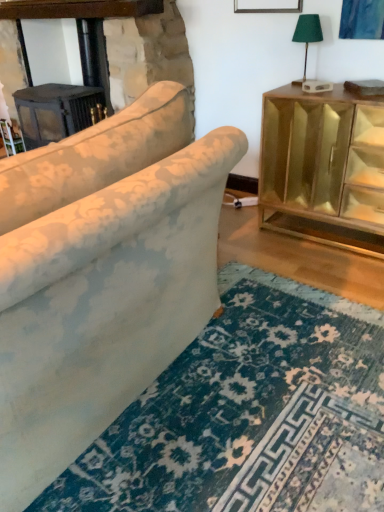
Describe the element at coordinates (323, 167) in the screenshot. This screenshot has height=512, width=384. I see `gold mirrored cabinet at right` at that location.

Where is `gold mirrored cabinet at right`? The image size is (384, 512). gold mirrored cabinet at right is located at coordinates (323, 167).

This screenshot has width=384, height=512. Identify the location of green fabric lampshade at upper right. (307, 36).

The height and width of the screenshot is (512, 384). Identify the location of dark gray wood fireplace at upper left. (83, 28).

Identify the location of gold mirrored cabinet at right. tap(323, 167).

Considering their positions, is gold mirrored cabinet at right located in front of or behind dark gray wood fireplace at upper left?

Visually, gold mirrored cabinet at right is located in front of dark gray wood fireplace at upper left.

Considering the positions of point (353, 247) and point (84, 9), is point (353, 247) closer or farther from the camera than point (84, 9)?

Point (353, 247) is closer to the camera than point (84, 9).

I want to click on fireplace to the left of gold mirrored cabinet at right, so click(x=83, y=28).

From the image's perspective, who appears lower, gold mirrored cabinet at right or dark gray wood fireplace at upper left?

From the image's view, gold mirrored cabinet at right is below.

Considering the sizes of objects dark gray wood fireplace at upper left and green fabric lampshade at upper right in the image provided, who is shorter, dark gray wood fireplace at upper left or green fabric lampshade at upper right?

green fabric lampshade at upper right is shorter.

From a real-world perspective, between dark gray wood fireplace at upper left and green fabric lampshade at upper right, who is vertically lower?

From a 3D spatial view, dark gray wood fireplace at upper left is below.

Could you tell me if dark gray wood fireplace at upper left is turned towards green fabric lampshade at upper right?

No.

Does dark gray wood fireplace at upper left have a smaller size compared to green fabric lampshade at upper right?

No, dark gray wood fireplace at upper left is not smaller than green fabric lampshade at upper right.

Which object is closer to the camera taking this photo, dark gray wood fireplace at upper left or gold mirrored cabinet at right?

gold mirrored cabinet at right is more forward.

Which is more to the left, dark gray wood fireplace at upper left or gold mirrored cabinet at right?

Positioned to the left is dark gray wood fireplace at upper left.

Consider the image. Considering the relative sizes of dark gray wood fireplace at upper left and gold mirrored cabinet at right in the image provided, is dark gray wood fireplace at upper left shorter than gold mirrored cabinet at right?

No, dark gray wood fireplace at upper left is not shorter than gold mirrored cabinet at right.

Is dark gray wood fireplace at upper left located outside gold mirrored cabinet at right?

dark gray wood fireplace at upper left is positioned outside gold mirrored cabinet at right.

Is green fabric lampshade at upper right facing away from dark gray wood fireplace at upper left?

That's not correct — green fabric lampshade at upper right is not looking away from dark gray wood fireplace at upper left.

From the image's perspective, is green fabric lampshade at upper right positioned above or below dark gray wood fireplace at upper left?

From the image's perspective, green fabric lampshade at upper right appears below dark gray wood fireplace at upper left.

Can you confirm if green fabric lampshade at upper right is shorter than dark gray wood fireplace at upper left?

Yes, green fabric lampshade at upper right is shorter than dark gray wood fireplace at upper left.

Considering the sizes of objects green fabric lampshade at upper right and dark gray wood fireplace at upper left in the image provided, who is bigger, green fabric lampshade at upper right or dark gray wood fireplace at upper left?

Bigger between the two is dark gray wood fireplace at upper left.

Can you confirm if dark gray wood fireplace at upper left is wider than floral fabric couch at center?

No.

Is dark gray wood fireplace at upper left aimed at floral fabric couch at center?

No, dark gray wood fireplace at upper left is not aimed at floral fabric couch at center.

Would you consider dark gray wood fireplace at upper left to be distant from floral fabric couch at center?

Absolutely, dark gray wood fireplace at upper left is distant from floral fabric couch at center.

Are floral fabric couch at center and green fabric lampshade at upper right far apart?

floral fabric couch at center is far away from green fabric lampshade at upper right.

Where is `table lamp above the floral fabric couch at center (from a real-world perspective)`? The width and height of the screenshot is (384, 512). table lamp above the floral fabric couch at center (from a real-world perspective) is located at coordinates (307, 36).

How different are the orientations of floral fabric couch at center and green fabric lampshade at upper right in degrees?

The angle between the facing direction of floral fabric couch at center and the facing direction of green fabric lampshade at upper right is 87.5 degrees.

From the image's perspective, which object appears higher, floral fabric couch at center or green fabric lampshade at upper right?

green fabric lampshade at upper right appears higher in the image.

From the image's perspective, does floral fabric couch at center appear higher than dark gray wood fireplace at upper left?

Actually, floral fabric couch at center appears below dark gray wood fireplace at upper left in the image.

Could you tell me if floral fabric couch at center is facing dark gray wood fireplace at upper left?

No, floral fabric couch at center is not aimed at dark gray wood fireplace at upper left.

Considering the relative sizes of floral fabric couch at center and dark gray wood fireplace at upper left in the image provided, is floral fabric couch at center smaller than dark gray wood fireplace at upper left?

Actually, floral fabric couch at center might be larger than dark gray wood fireplace at upper left.

Which is farther, (55, 292) or (81, 41)?

The point (81, 41) is farther from the camera.

Locate an element on the screen. The image size is (384, 512). fireplace behind the gold mirrored cabinet at right is located at coordinates click(x=83, y=28).

Where is `fireplace above the green fabric lampshade at upper right (from the image's perspective)`? This screenshot has width=384, height=512. fireplace above the green fabric lampshade at upper right (from the image's perspective) is located at coordinates (83, 28).

Looking at the image, which one is located further to green fabric lampshade at upper right, floral fabric couch at center or gold mirrored cabinet at right?

floral fabric couch at center.

Estimate the real-world distances between objects in this image. Which object is further from floral fabric couch at center, gold mirrored cabinet at right or green fabric lampshade at upper right?

green fabric lampshade at upper right is positioned further to the anchor floral fabric couch at center.

Based on their spatial positions, is green fabric lampshade at upper right or gold mirrored cabinet at right closer to dark gray wood fireplace at upper left?

green fabric lampshade at upper right lies closer to dark gray wood fireplace at upper left than the other object.

Which object lies nearer to the anchor point green fabric lampshade at upper right, dark gray wood fireplace at upper left or gold mirrored cabinet at right?

The object closer to green fabric lampshade at upper right is gold mirrored cabinet at right.

Which object lies nearer to the anchor point dark gray wood fireplace at upper left, gold mirrored cabinet at right or floral fabric couch at center?

The object closer to dark gray wood fireplace at upper left is gold mirrored cabinet at right.

Based on their spatial positions, is floral fabric couch at center or dark gray wood fireplace at upper left closer to gold mirrored cabinet at right?

floral fabric couch at center.

Looking at the image, which one is located further to gold mirrored cabinet at right, floral fabric couch at center or green fabric lampshade at upper right?

floral fabric couch at center is positioned further to the anchor gold mirrored cabinet at right.

Which object lies nearer to the anchor point dark gray wood fireplace at upper left, green fabric lampshade at upper right or floral fabric couch at center?

The object closer to dark gray wood fireplace at upper left is green fabric lampshade at upper right.

Locate an element on the screen. The width and height of the screenshot is (384, 512). table lamp between dark gray wood fireplace at upper left and gold mirrored cabinet at right in the horizontal direction is located at coordinates (307, 36).

The image size is (384, 512). In order to click on table lamp between floral fabric couch at center and dark gray wood fireplace at upper left from front to back in this screenshot , I will do `click(307, 36)`.

The height and width of the screenshot is (512, 384). I want to click on table between floral fabric couch at center and dark gray wood fireplace at upper left from front to back, so click(323, 167).

Locate an element on the screen. The width and height of the screenshot is (384, 512). table between floral fabric couch at center and green fabric lampshade at upper right in the front-back direction is located at coordinates (323, 167).